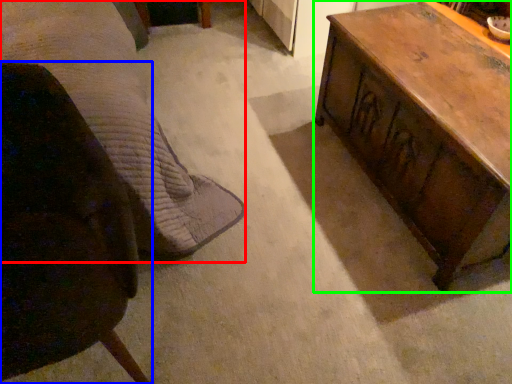
Question: Estimate the real-world distances between objects in this image. Which object is closer to bed (highlighted by a red box), chair (highlighted by a blue box) or table (highlighted by a green box)?

Choices:
 (A) chair
 (B) table

Answer: (A)